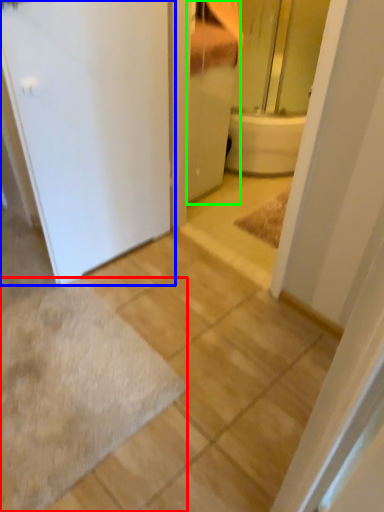
Question: Based on their relative distances, which object is farther from bath mat (highlighted by a red box)? Choose from door (highlighted by a blue box) and bathroom cabinet (highlighted by a green box).

Choices:
 (A) door
 (B) bathroom cabinet

Answer: (B)